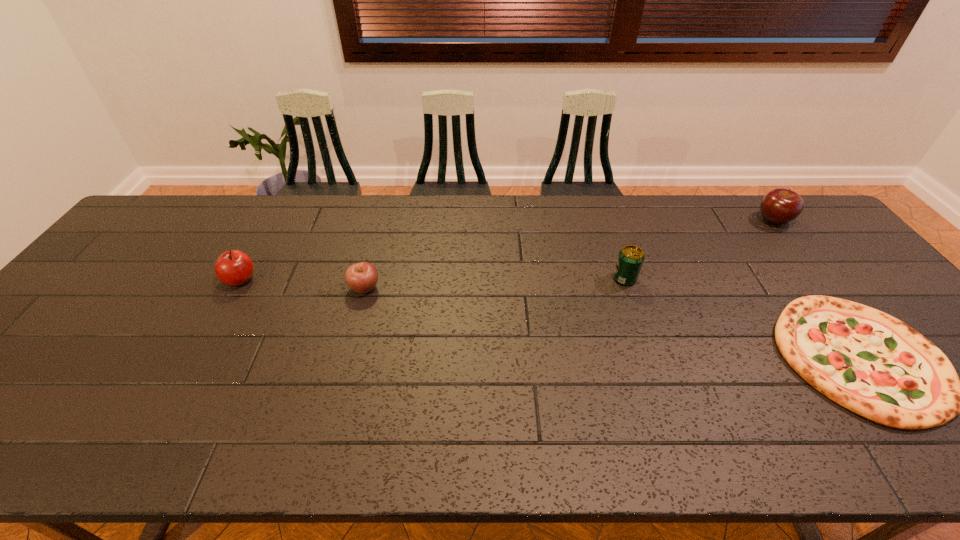
Locate an element on the screen. vacant area that lies between the rightmost apple and the third object from right to left is located at coordinates (699, 249).

Where is `free space between the beer can and the rightmost apple`? This screenshot has height=540, width=960. free space between the beer can and the rightmost apple is located at coordinates (699, 249).

At what (x,y) coordinates should I click in order to perform the action: click on empty space between the third object from left to right and the leftmost object. Please return your answer as a coordinate pair (x, y). This screenshot has height=540, width=960. Looking at the image, I should click on (433, 279).

I want to click on free area in between the leftmost object and the second apple from right to left, so click(x=302, y=284).

You are a GUI agent. You are given a task and a screenshot of the screen. Output one action in this format:
    pyautogui.click(x=<x>, y=<y>)
    Task: Click on the free area in between the leftmost apple and the rightmost apple
    
    Given the screenshot: What is the action you would take?
    pyautogui.click(x=507, y=250)

You are a GUI agent. You are given a task and a screenshot of the screen. Output one action in this format:
    pyautogui.click(x=<x>, y=<y>)
    Task: Click on the object that is the second closest to the beer can
    
    Given the screenshot: What is the action you would take?
    pyautogui.click(x=779, y=206)

Identify the location of the fourth closest object to the fourth tallest object. (779, 206).

Where is `apple that can be found as the closest to the rightmost apple`? The image size is (960, 540). apple that can be found as the closest to the rightmost apple is located at coordinates pyautogui.click(x=362, y=277).

Identify which apple is located as the second nearest to the fourth object from right to left. Please provide its 2D coordinates. Your answer should be formatted as a tuple, i.e. [(x, y)], where the tuple contains the x and y coordinates of a point satisfying the conditions above.

[(779, 206)]